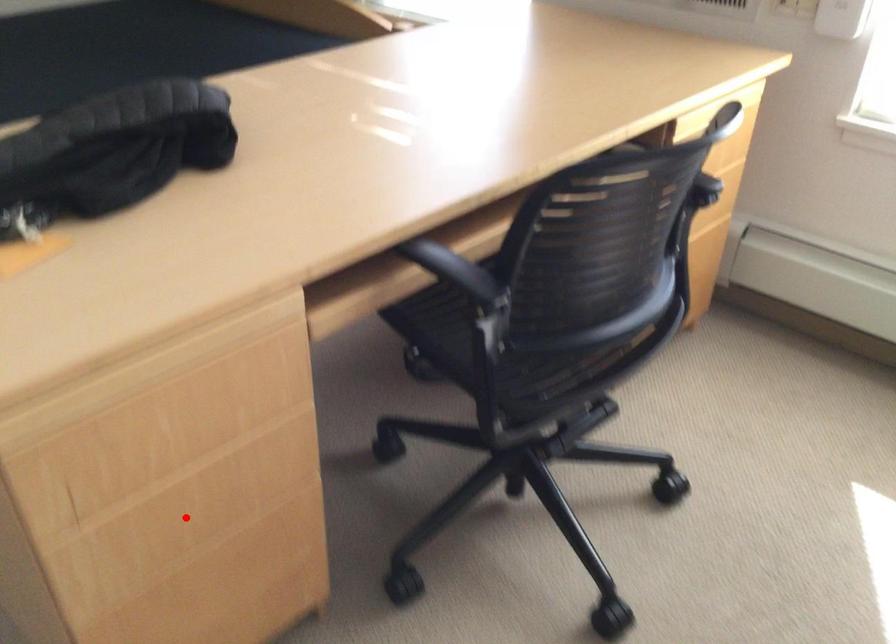
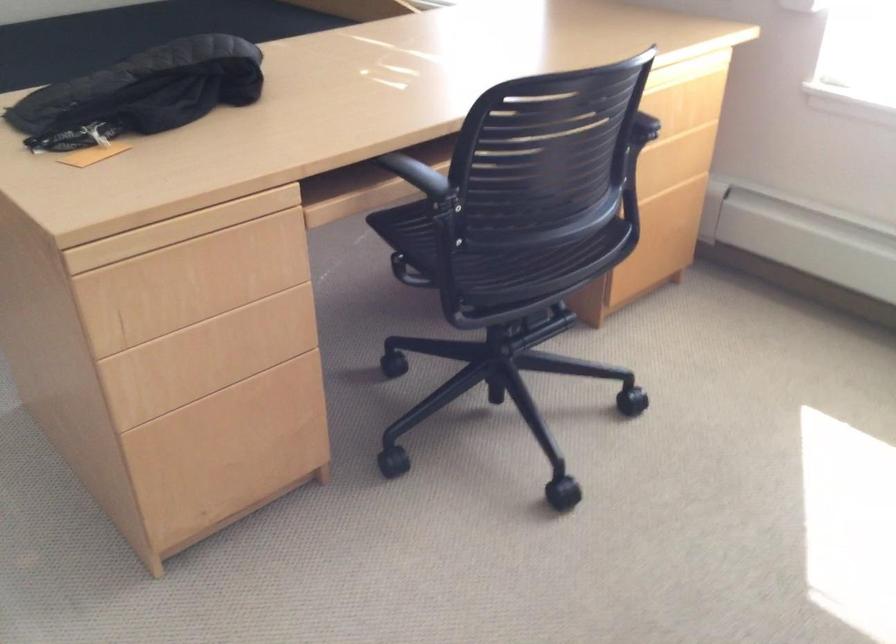
Question: I am providing you with two images of the same scene from different viewpoints. A red point is marked on the first image. Is the red point's position out of view in image 2?

Choices:
 (A) Yes
 (B) No

Answer: (B)